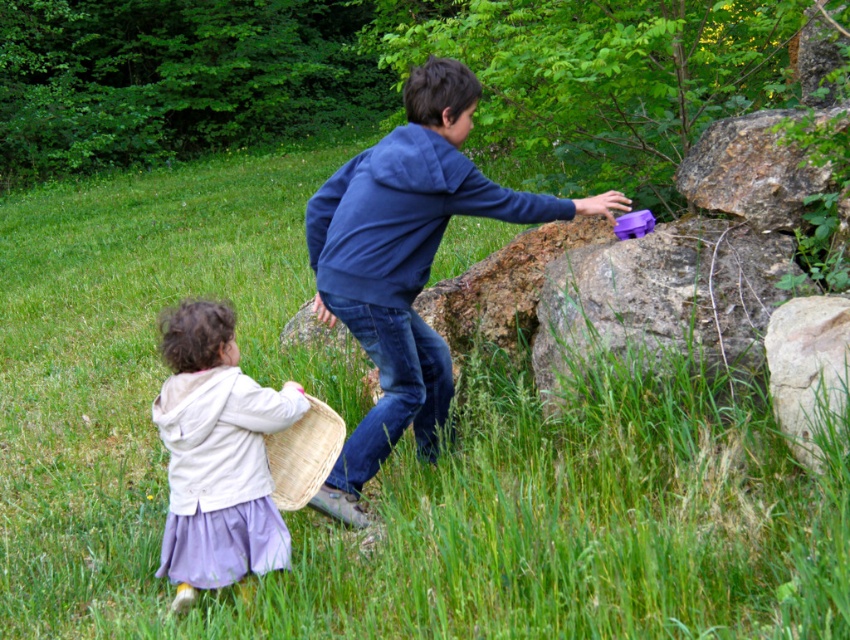
Does point (401, 208) come farther from viewer compared to point (809, 419)?

Yes.

Is point (442, 353) less distant than point (828, 384)?

No, it is not.

I want to click on blue cotton hoodie at center, so click(x=406, y=262).

Is blue cotton hoodie at center in front of rusty stone boulder at upper right?

Yes, blue cotton hoodie at center is in front of rusty stone boulder at upper right.

Looking at this image, is blue cotton hoodie at center to the right of rusty stone boulder at upper right from the viewer's perspective?

No, blue cotton hoodie at center is not to the right of rusty stone boulder at upper right.

This screenshot has height=640, width=850. Find the location of `blue cotton hoodie at center`. blue cotton hoodie at center is located at coordinates (406, 262).

Can you confirm if rough stone boulder at center right is shorter than rusty stone boulder at upper right?

Incorrect, rough stone boulder at center right's height does not fall short of rusty stone boulder at upper right's.

Image resolution: width=850 pixels, height=640 pixels. What do you see at coordinates (661, 300) in the screenshot?
I see `rough stone boulder at center right` at bounding box center [661, 300].

From the picture: Who is more forward, (627, 280) or (754, 161)?

Point (627, 280)

Identify the location of rough stone boulder at center right. (661, 300).